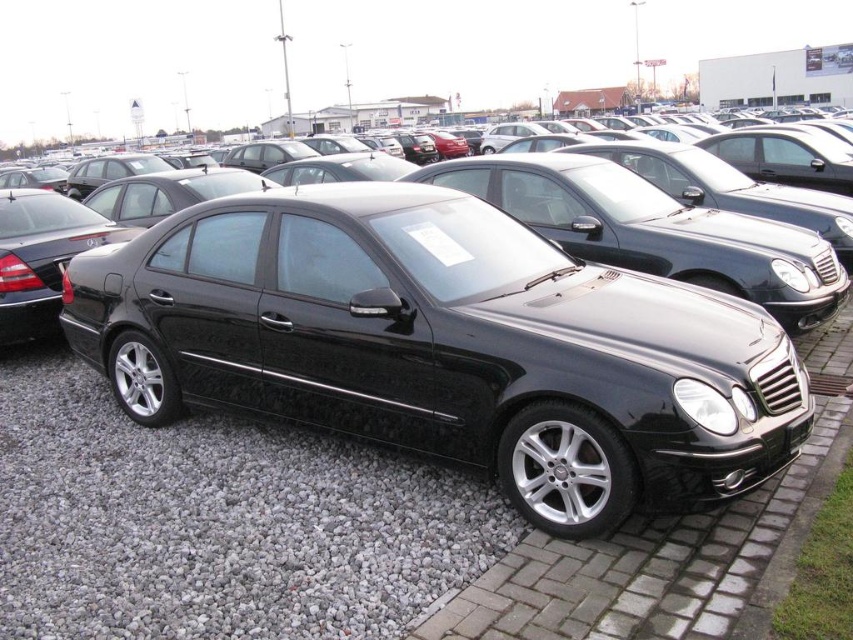
Measure the distance between point (486,428) and camera.

A distance of 3.25 meters exists between point (486,428) and camera.

Who is taller, glossy black car at center or gray gravel at lower center?

With more height is glossy black car at center.

Does point (302, 348) come behind point (381, 499)?

That is True.

At what (x,y) coordinates should I click in order to perform the action: click on glossy black car at center. Please return your answer as a coordinate pair (x, y). This screenshot has width=853, height=640. Looking at the image, I should click on (445, 346).